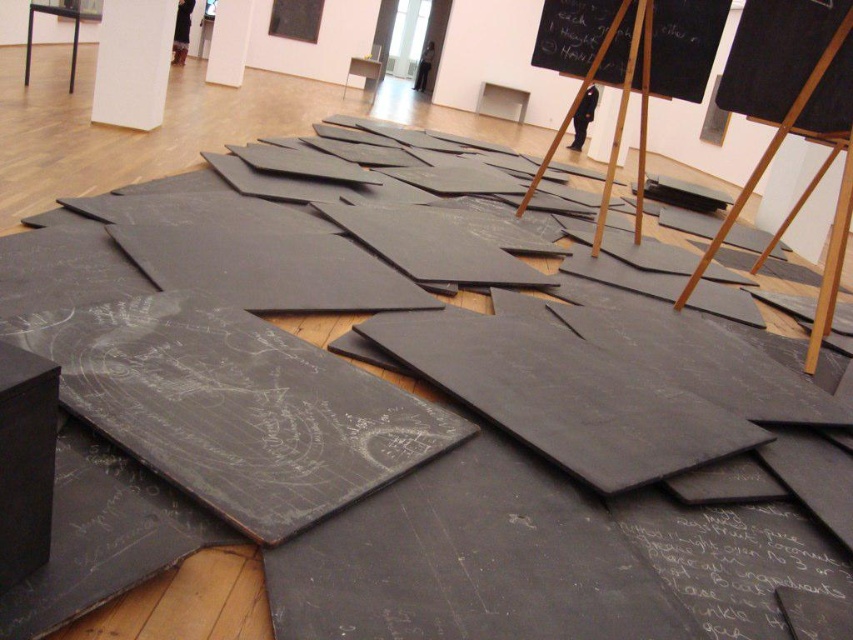
You are an artist who wants to draw on the wooden easel at center and the black chalkboard at upper center. Which object should you approach first if you are standing in the middle of the gallery?

You should approach the wooden easel at center first because it is located to the right of the black chalkboard at upper center, making it closer when standing in the middle of the gallery.

You are an artist planning to draw a large mural on one of the black chalkboards. Given the sizes of the black chalkboard at center and the black chalkboard at upper center, which one would allow you to create a larger mural?

The black chalkboard at upper center has a greater width than the black chalkboard at center, so it would allow you to create a larger mural.

In the scene shown: You are an artist standing at the entrance of the gallery. You want to reach the black chalkboard at center to draw something. What is the shortest path you can take without stepping on any of the dark gray slate boards?

The shortest path would be to move directly towards the black chalkboard at center since it is located at point (734, 560), which is not on any of the dark gray slate boards.